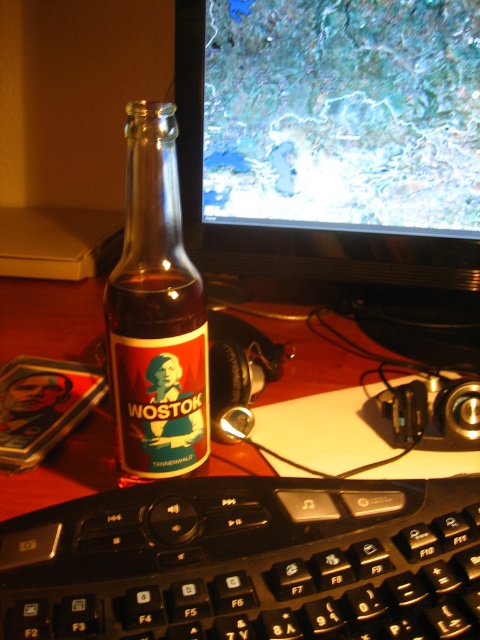
Is black plastic keyboard at lower center to the left of translucent glass bottle at center from the viewer's perspective?

In fact, black plastic keyboard at lower center is to the right of translucent glass bottle at center.

Find the location of a particular element. black plastic keyboard at lower center is located at coordinates (248, 561).

Between point (149, 496) and point (167, 300), which one is positioned in front?

Point (149, 496) is more forward.

Image resolution: width=480 pixels, height=640 pixels. Identify the location of black plastic keyboard at lower center. (248, 561).